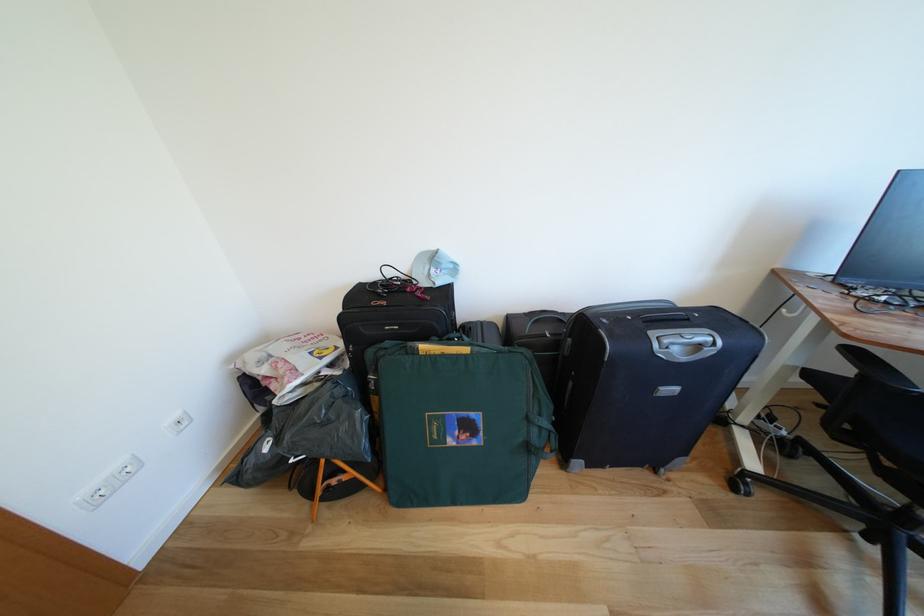
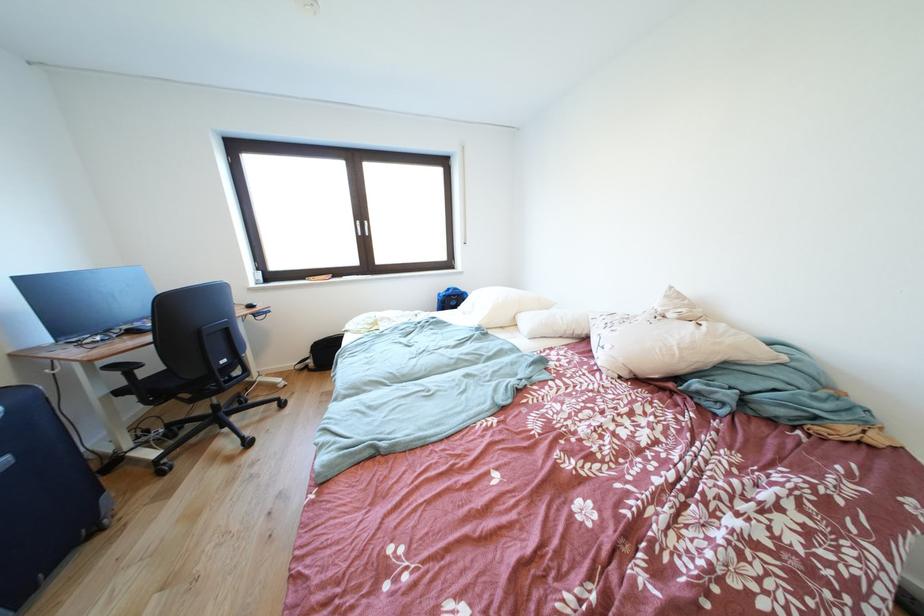
First-person continuous shooting, in which direction is the camera rotating?

The camera's rotation is toward right-down.